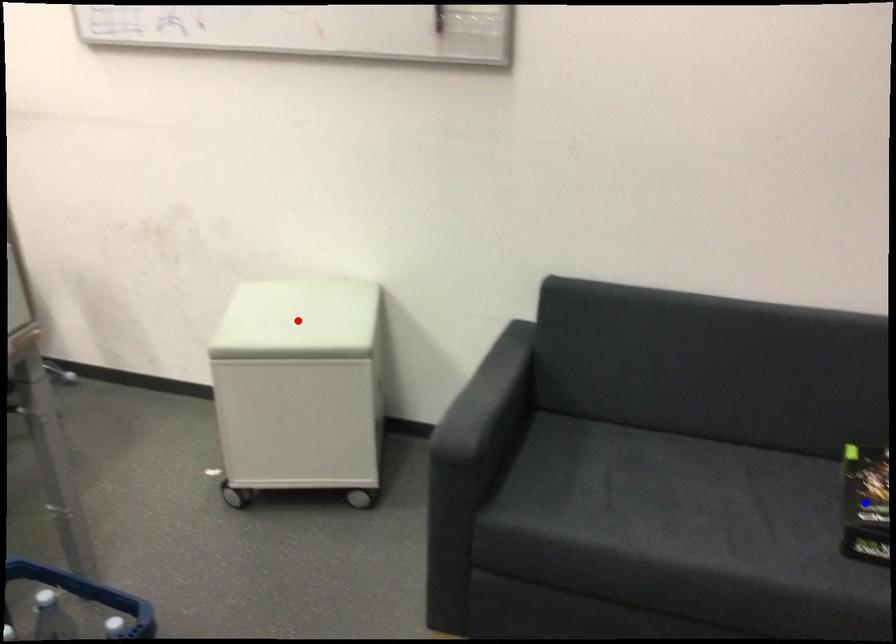
Question: Two points are marked on the image. Which point is closer to the camera?

Choices:
 (A) Blue point is closer.
 (B) Red point is closer.

Answer: (A)